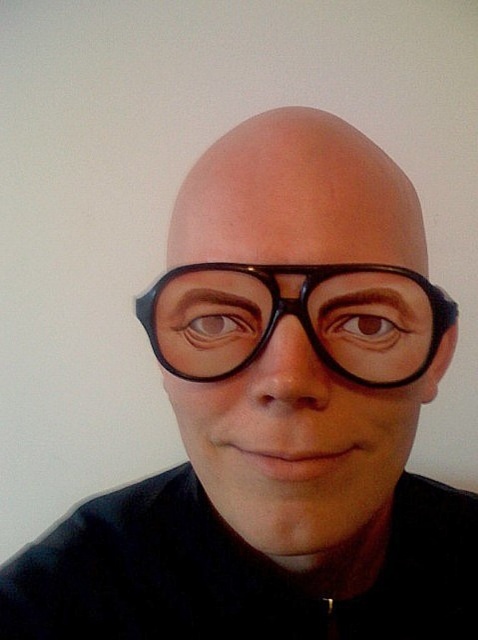
Consider the image. You are a optometrist examining two pairs of glasses in the image. The glasses are labeled as black matte glasses at center and black plastic glasses at center. Which of these two glasses has a larger frame size?

The black matte glasses at center is larger in size than the black plastic glasses at center.